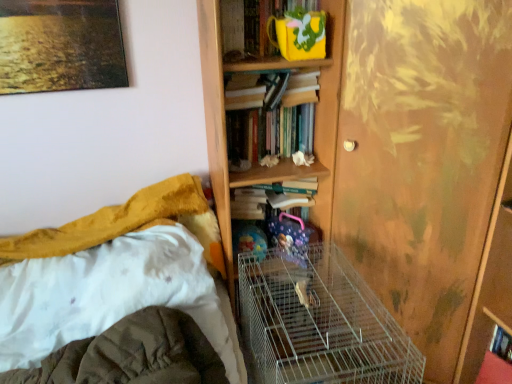
Question: From a real-world perspective, does hardcover books at center, which ranks as the second book in top-to-bottom order, sit lower than silver wire birdcage at center?

Choices:
 (A) no
 (B) yes

Answer: (A)

Question: Is hardcover books at center, which appears as the second book when ordered from the bottom, far away from silver wire birdcage at center?

Choices:
 (A) no
 (B) yes

Answer: (A)

Question: Is hardcover books at center, which appears as the second book when ordered from the bottom, turned away from silver wire birdcage at center?

Choices:
 (A) yes
 (B) no

Answer: (B)

Question: Does hardcover books at center, which appears as the second book when ordered from the bottom, have a lesser width compared to silver wire birdcage at center?

Choices:
 (A) no
 (B) yes

Answer: (B)

Question: Is hardcover books at center, which ranks as the second book in top-to-bottom order, in contact with silver wire birdcage at center?

Choices:
 (A) no
 (B) yes

Answer: (A)

Question: Is hardcover books at center, which appears as the second book when ordered from the bottom, to the left or to the right of white fabric bed at lower left in the image?

Choices:
 (A) right
 (B) left

Answer: (A)

Question: From the image's perspective, is hardcover books at center, which ranks as the second book in top-to-bottom order, positioned above or below white fabric bed at lower left?

Choices:
 (A) below
 (B) above

Answer: (B)

Question: Is point (279, 132) closer or farther from the camera than point (148, 276)?

Choices:
 (A) closer
 (B) farther

Answer: (B)

Question: Based on their sizes in the image, would you say hardcover books at center, which ranks as the second book in top-to-bottom order, is bigger or smaller than white fabric bed at lower left?

Choices:
 (A) small
 (B) big

Answer: (A)

Question: In terms of width, does wooden screen door at right look wider or thinner when compared to yellow fabric book at upper center, acting as the 3th book starting from the bottom?

Choices:
 (A) thin
 (B) wide

Answer: (B)

Question: From the image's perspective, is wooden screen door at right above or below yellow fabric book at upper center, which is the 1th book from top to bottom?

Choices:
 (A) below
 (B) above

Answer: (A)

Question: Would you say wooden screen door at right is to the left or to the right of yellow fabric book at upper center, acting as the 3th book starting from the bottom, in the picture?

Choices:
 (A) right
 (B) left

Answer: (A)

Question: In the image, is wooden screen door at right positioned in front of or behind yellow fabric book at upper center, which is the 1th book from top to bottom?

Choices:
 (A) behind
 (B) front

Answer: (B)

Question: From a real-world perspective, is hardcover book at center, the third book in the top-to-bottom sequence, above or below wooden screen door at right?

Choices:
 (A) below
 (B) above

Answer: (A)

Question: Is hardcover book at center, the third book in the top-to-bottom sequence, in front of or behind wooden screen door at right in the image?

Choices:
 (A) front
 (B) behind

Answer: (B)